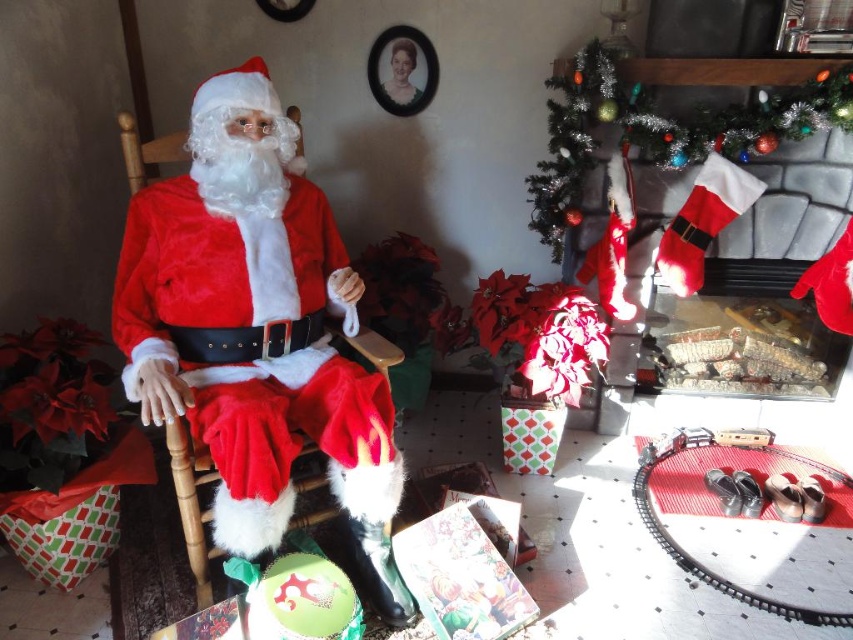
Question: Can you confirm if velvet red santa at left is thinner than red velvet stocking at upper right?

Choices:
 (A) no
 (B) yes

Answer: (B)

Question: Does velvet red santa at left appear under red velvet stocking at upper right?

Choices:
 (A) yes
 (B) no

Answer: (A)

Question: Which of the following is the farthest from the observer?

Choices:
 (A) (639, 90)
 (B) (247, 438)

Answer: (A)

Question: Can you confirm if velvet red santa at left is smaller than red velvet stocking at upper right?

Choices:
 (A) yes
 (B) no

Answer: (B)